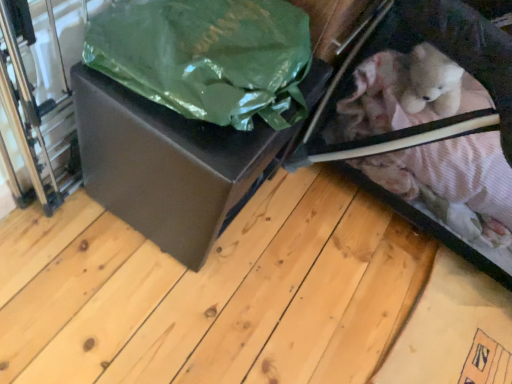
Question: Considering the positions of green matte plastic bag at upper left and matte black box at center in the image, is green matte plastic bag at upper left wider or thinner than matte black box at center?

Choices:
 (A) thin
 (B) wide

Answer: (A)

Question: In terms of height, does green matte plastic bag at upper left look taller or shorter compared to matte black box at center?

Choices:
 (A) short
 (B) tall

Answer: (A)

Question: Estimate the real-world distances between objects in this image. Which object is closer to the velvet pink fabric baby carriage at lower right?

Choices:
 (A) green matte plastic bag at upper left
 (B) matte black box at center

Answer: (B)

Question: Which object is positioned farthest from the velvet pink fabric baby carriage at lower right?

Choices:
 (A) green matte plastic bag at upper left
 (B) matte black box at center

Answer: (A)